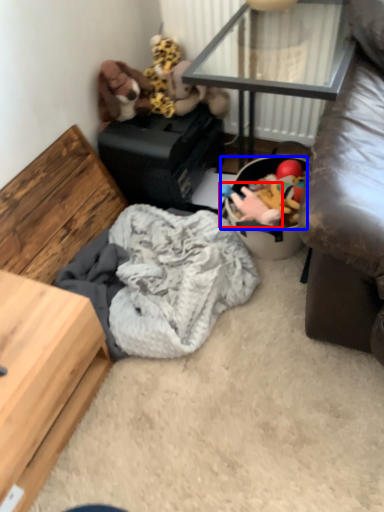
Question: Which object appears farthest to the camera in this image, toy (highlighted by a red box) or stuff (highlighted by a blue box)?

Choices:
 (A) toy
 (B) stuff

Answer: (A)